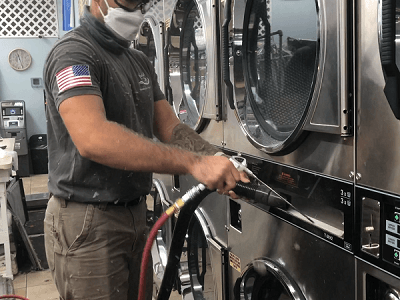
Find the location of a particular element. The image size is (400, 300). floor is located at coordinates (42, 295).